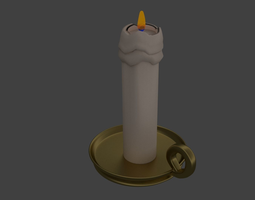
I want to click on empty space left of candle, so click(58, 107).